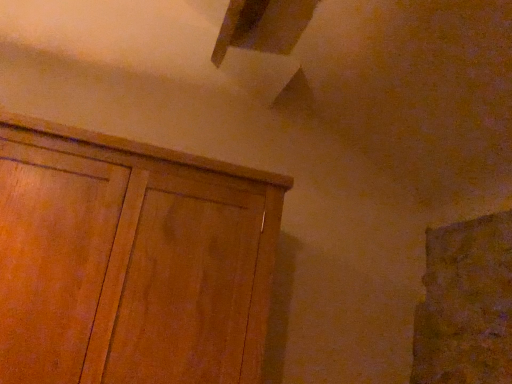
Where is `matte wood cupboard at left`? This screenshot has height=384, width=512. matte wood cupboard at left is located at coordinates coord(130,261).

In order to face matte wood cupboard at left, should I rotate leftwards or rightwards?

You should look left and rotate roughly 19.177 degrees.

What is the approximate height of matte wood cupboard at left?

The height of matte wood cupboard at left is 31.69 inches.

What do you see at coordinates (130, 261) in the screenshot? I see `matte wood cupboard at left` at bounding box center [130, 261].

You are a GUI agent. You are given a task and a screenshot of the screen. Output one action in this format:
    pyautogui.click(x=<x>, y=<y>)
    Task: Click on the matte wood cupboard at left
    The image size is (512, 384).
    Given the screenshot: What is the action you would take?
    pyautogui.click(x=130, y=261)